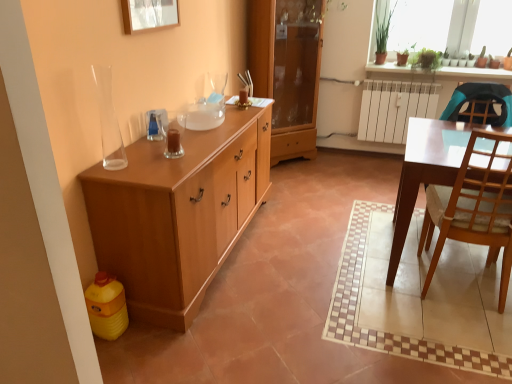
Question: Considering the relative sizes of green leafy plant at upper right, which appears as the 2th houseplant when viewed from the right, and light brown wood cabinet at left, positioned as the 2th cabinetry in back-to-front order, in the image provided, is green leafy plant at upper right, which appears as the 2th houseplant when viewed from the right, bigger than light brown wood cabinet at left, positioned as the 2th cabinetry in back-to-front order,?

Choices:
 (A) no
 (B) yes

Answer: (A)

Question: From the image's perspective, does green leafy plant at upper right, which appears as the 2th houseplant when viewed from the right, appear higher than light brown wood cabinet at left, positioned as the 2th cabinetry in back-to-front order?

Choices:
 (A) no
 (B) yes

Answer: (B)

Question: Does green leafy plant at upper right, the first houseplant when ordered from left to right, appear on the left side of light brown wood cabinet at left, positioned as the 2th cabinetry in back-to-front order?

Choices:
 (A) no
 (B) yes

Answer: (A)

Question: From a real-world perspective, is green leafy plant at upper right, the first houseplant when ordered from left to right, located higher than light brown wood cabinet at left, positioned as the 2th cabinetry in back-to-front order?

Choices:
 (A) no
 (B) yes

Answer: (B)

Question: Are green leafy plant at upper right, which appears as the 2th houseplant when viewed from the right, and light brown wood cabinet at left, positioned as the 2th cabinetry in back-to-front order, far apart?

Choices:
 (A) yes
 (B) no

Answer: (A)

Question: Could you tell me if green leafy plant at upper right, the first houseplant when ordered from left to right, is facing light brown wood cabinet at left, which is the first cabinetry in front-to-back order?

Choices:
 (A) no
 (B) yes

Answer: (A)

Question: Are light brown wood cabinet at left, which is the first cabinetry in front-to-back order, and wooden cabinet at center, the 2th cabinetry in the front-to-back sequence, located far from each other?

Choices:
 (A) yes
 (B) no

Answer: (A)

Question: From a real-world perspective, is light brown wood cabinet at left, which is the first cabinetry in front-to-back order, physically above wooden cabinet at center, the 2th cabinetry in the front-to-back sequence?

Choices:
 (A) no
 (B) yes

Answer: (A)

Question: Would you say light brown wood cabinet at left, positioned as the 2th cabinetry in back-to-front order, contains wooden cabinet at center, positioned as the 1th cabinetry in back-to-front order?

Choices:
 (A) yes
 (B) no

Answer: (B)

Question: Is light brown wood cabinet at left, which is the first cabinetry in front-to-back order, outside wooden cabinet at center, the 2th cabinetry in the front-to-back sequence?

Choices:
 (A) no
 (B) yes

Answer: (B)

Question: Does light brown wood cabinet at left, which is the first cabinetry in front-to-back order, have a greater width compared to wooden cabinet at center, the 2th cabinetry in the front-to-back sequence?

Choices:
 (A) no
 (B) yes

Answer: (B)

Question: Is light brown wood cabinet at left, which is the first cabinetry in front-to-back order, at the left side of wooden cabinet at center, the 2th cabinetry in the front-to-back sequence?

Choices:
 (A) no
 (B) yes

Answer: (B)

Question: Is green matte plant at upper right, positioned as the second houseplant in left-to-right order, wider than green leafy plants at upper right?

Choices:
 (A) no
 (B) yes

Answer: (B)